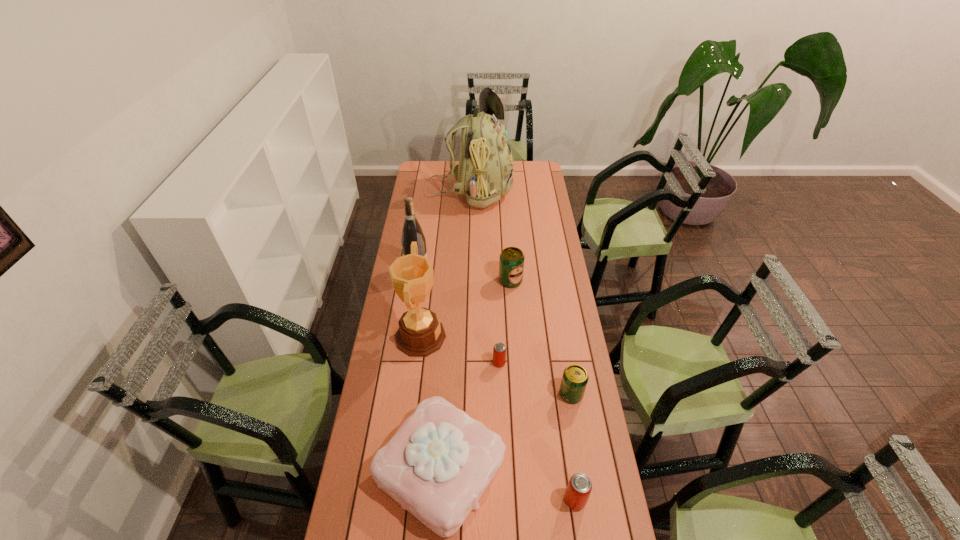
Where is `free space between the nearer pink beer can and the smaller green beer can`? The width and height of the screenshot is (960, 540). free space between the nearer pink beer can and the smaller green beer can is located at coordinates (573, 447).

Identify which object is the third nearest to the third nearest beer can. Please provide its 2D coordinates. Your answer should be formatted as a tuple, i.e. [(x, y)], where the tuple contains the x and y coordinates of a point satisfying the conditions above.

[(575, 378)]

Point out which object is positioned as the seventh nearest to the farther pink beer can. Please provide its 2D coordinates. Your answer should be formatted as a tuple, i.e. [(x, y)], where the tuple contains the x and y coordinates of a point satisfying the conditions above.

[(485, 171)]

Locate an element on the screen. This screenshot has height=540, width=960. the third closest beer can to the shortest object is located at coordinates (578, 490).

Locate an element on the screen. The width and height of the screenshot is (960, 540). beer can that stands as the second closest to the third nearest object is located at coordinates (578, 490).

At what (x,y) coordinates should I click in order to perform the action: click on vacant space that satisfies the following two spatial constraints: 1. on the front-facing side of the farthest object; 2. on the right side of the bigger pink beer can. Please return your answer as a coordinate pair (x, y). Looking at the image, I should click on (463, 500).

Image resolution: width=960 pixels, height=540 pixels. Find the location of `vacant space that satisfies the following two spatial constraints: 1. on the back side of the left pink beer can; 2. on the front-facing side of the backpack`. vacant space that satisfies the following two spatial constraints: 1. on the back side of the left pink beer can; 2. on the front-facing side of the backpack is located at coordinates (492, 192).